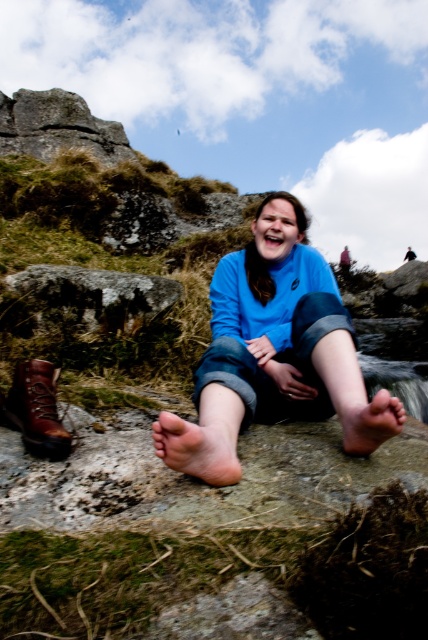
Question: Does blue cotton sweatshirt at center have a smaller size compared to brown leather boot at lower left?

Choices:
 (A) yes
 (B) no

Answer: (B)

Question: Is blue cotton sweatshirt at center positioned in front of brown leather boot at lower left?

Choices:
 (A) yes
 (B) no

Answer: (A)

Question: Does blue cotton sweatshirt at center appear under brown leather boot at lower left?

Choices:
 (A) no
 (B) yes

Answer: (A)

Question: Which object is farther from the camera taking this photo?

Choices:
 (A) blue cotton sweatshirt at center
 (B) brown leather boot at lower left

Answer: (B)

Question: Which of the following is the closest to the observer?

Choices:
 (A) blue cotton sweatshirt at center
 (B) brown leather boot at lower left

Answer: (A)